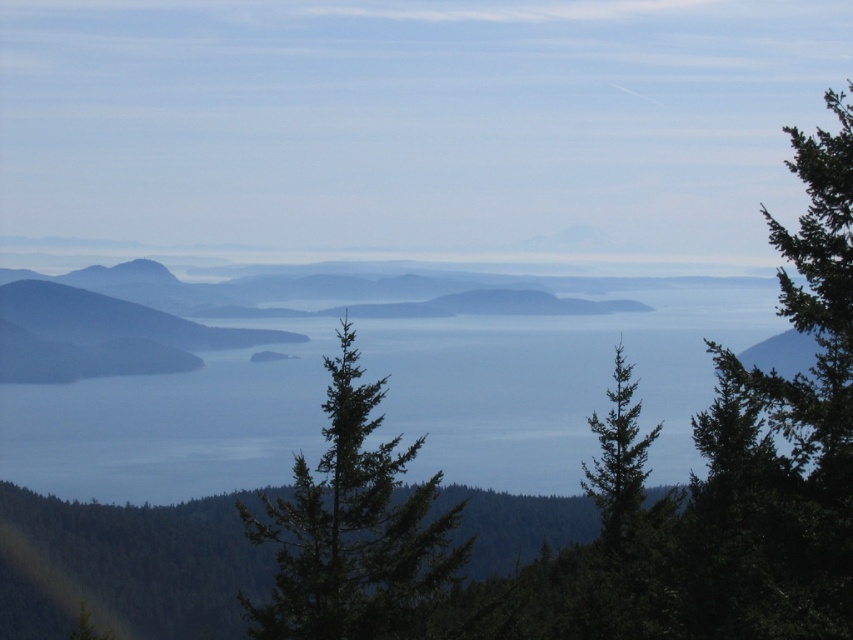
Question: Based on their relative distances, which object is farther from the green needle-like tree at center?

Choices:
 (A) blue water at center
 (B) green textured tree at center

Answer: (A)

Question: Can you confirm if green needle-like tree at center is positioned below green textured tree at center?

Choices:
 (A) no
 (B) yes

Answer: (A)

Question: Based on their relative distances, which object is nearer to the blue water at center?

Choices:
 (A) green needle-like tree at center
 (B) green textured tree at center

Answer: (B)

Question: Is the position of green needle-like tree at center more distant than that of green textured tree at center?

Choices:
 (A) yes
 (B) no

Answer: (B)

Question: Which point is farther from the camera taking this photo?

Choices:
 (A) (608, 452)
 (B) (520, 451)

Answer: (B)

Question: In this image, where is green needle-like tree at center located relative to green textured tree at center?

Choices:
 (A) left
 (B) right

Answer: (A)